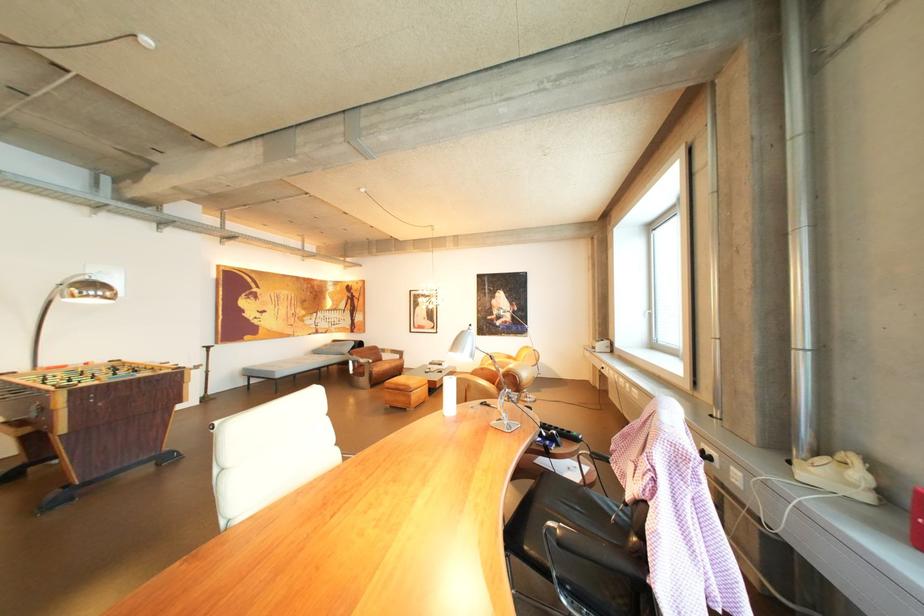
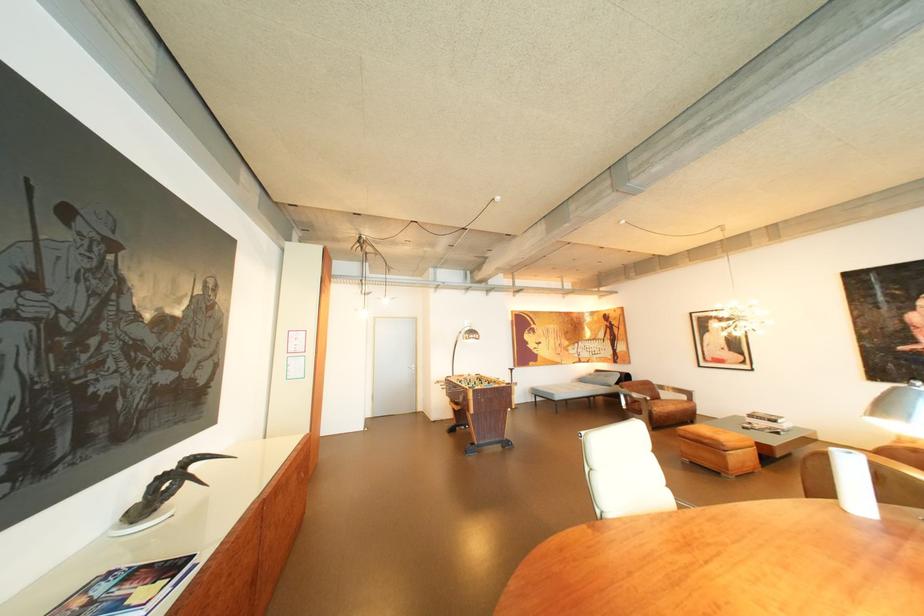
In the second image, find the point that corresponds to (x=444, y=363) in the first image.

(763, 416)